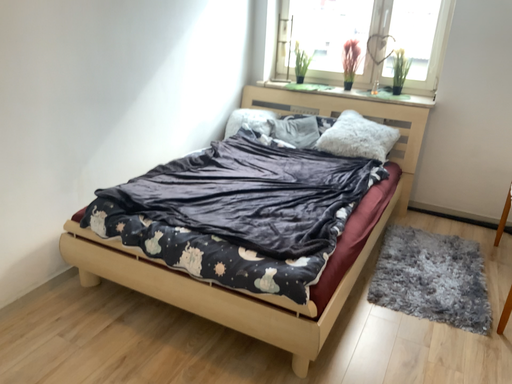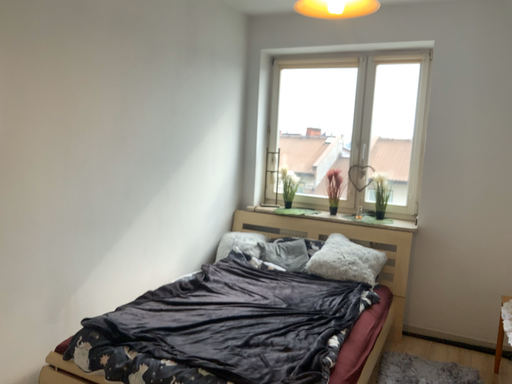
Question: Which way did the camera rotate in the video?

Choices:
 (A) rotated upward
 (B) rotated downward

Answer: (A)